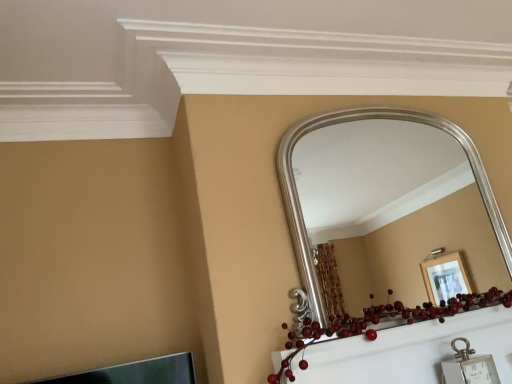
Question: Is silver metallic mirror at upper center situated inside shiny red berries at center or outside?

Choices:
 (A) outside
 (B) inside

Answer: (A)

Question: Considering the positions of silver metallic mirror at upper center and shiny red berries at center in the image, is silver metallic mirror at upper center wider or thinner than shiny red berries at center?

Choices:
 (A) wide
 (B) thin

Answer: (B)

Question: In the image, is silver metallic mirror at upper center on the left side or the right side of shiny red berries at center?

Choices:
 (A) right
 (B) left

Answer: (A)

Question: From the image's perspective, is shiny red berries at center located above or below silver metallic mirror at upper center?

Choices:
 (A) below
 (B) above

Answer: (A)

Question: Based on their positions, is shiny red berries at center located to the left or right of silver metallic mirror at upper center?

Choices:
 (A) left
 (B) right

Answer: (A)

Question: From their relative heights in the image, would you say shiny red berries at center is taller or shorter than silver metallic mirror at upper center?

Choices:
 (A) short
 (B) tall

Answer: (A)

Question: Which is correct: shiny red berries at center is inside silver metallic mirror at upper center, or outside of it?

Choices:
 (A) outside
 (B) inside

Answer: (A)